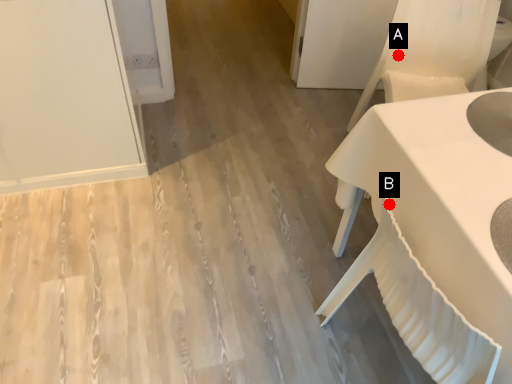
Question: Two points are circled on the image, labeled by A and B beside each circle. Which point is farther to the camera?

Choices:
 (A) A is further
 (B) B is further

Answer: (A)